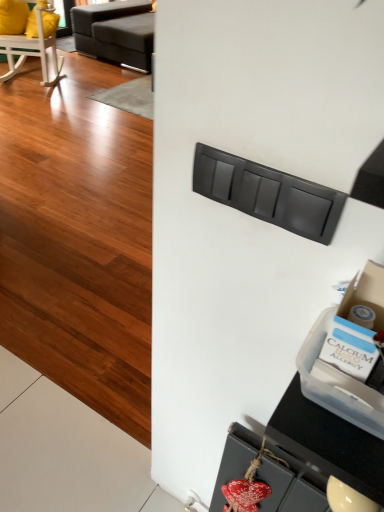
What do you see at coordinates (32, 49) in the screenshot? I see `wooden rocking chair at upper left` at bounding box center [32, 49].

Identify the location of matte black drawer at center, which ranks as the second drawer in bottom-to-top order. click(x=268, y=194).

This screenshot has width=384, height=512. What do you see at coordinates (116, 32) in the screenshot? I see `dark gray fabric studio couch at upper left` at bounding box center [116, 32].

Find the location of a particular element. The height and width of the screenshot is (512, 384). wooden rocking chair at upper left is located at coordinates (32, 49).

Which object is positioned more to the left, matte black drawer at center, which is the 1th drawer from top to bottom, or wooden rocking chair at upper left?

From the viewer's perspective, wooden rocking chair at upper left appears more on the left side.

Between matte black drawer at center, which ranks as the second drawer in bottom-to-top order, and wooden rocking chair at upper left, which one has more height?

wooden rocking chair at upper left.

Does matte black drawer at center, which is the 1th drawer from front to back, turn towards wooden rocking chair at upper left?

No, matte black drawer at center, which is the 1th drawer from front to back, is not aimed at wooden rocking chair at upper left.

The width and height of the screenshot is (384, 512). In order to click on chair on the left of the matte gray drawer at lower center, the 1th drawer when ordered from bottom to top in this screenshot , I will do click(32, 49).

Does matte gray drawer at lower center, the 2th drawer in the front-to-back sequence, lie behind wooden rocking chair at upper left?

No.

Is matte gray drawer at lower center, placed as the second drawer when sorted from top to bottom, bigger than wooden rocking chair at upper left?

Actually, matte gray drawer at lower center, placed as the second drawer when sorted from top to bottom, might be smaller than wooden rocking chair at upper left.

Which is in front, point (293, 506) or point (53, 42)?

The point (293, 506) is closer to the camera.

Is dark gray fabric studio couch at upper left turned away from wooden rocking chair at upper left?

dark gray fabric studio couch at upper left is not turned away from wooden rocking chair at upper left.

Is the position of dark gray fabric studio couch at upper left less distant than that of wooden rocking chair at upper left?

No, dark gray fabric studio couch at upper left is further to the viewer.

You are a GUI agent. You are given a task and a screenshot of the screen. Output one action in this format:
    pyautogui.click(x=<x>, y=<y>)
    Task: Click on the studio couch lying above the wooden rocking chair at upper left (from the image's perspective)
    The width and height of the screenshot is (384, 512).
    Given the screenshot: What is the action you would take?
    pyautogui.click(x=116, y=32)

Considering the relative sizes of dark gray fabric studio couch at upper left and wooden rocking chair at upper left in the image provided, is dark gray fabric studio couch at upper left wider than wooden rocking chair at upper left?

Yes.

Is wooden rocking chair at upper left with matte gray drawer at lower center, placed as the second drawer when sorted from top to bottom?

No, wooden rocking chair at upper left is not beside matte gray drawer at lower center, placed as the second drawer when sorted from top to bottom.

What are the coordinates of `chair behind the matte gray drawer at lower center, placed as the second drawer when sorted from top to bottom` in the screenshot? It's located at (32, 49).

From the image's perspective, relative to matte gray drawer at lower center, the 1th drawer when ordered from bottom to top, is wooden rocking chair at upper left above or below?

From the image's perspective, wooden rocking chair at upper left appears above matte gray drawer at lower center, the 1th drawer when ordered from bottom to top.

Measure the distance from wooden rocking chair at upper left to matte gray drawer at lower center, the 1th drawer when ordered from bottom to top.

wooden rocking chair at upper left is 4.23 meters away from matte gray drawer at lower center, the 1th drawer when ordered from bottom to top.

From the image's perspective, is matte gray drawer at lower center, the 2th drawer in the front-to-back sequence, over dark gray fabric studio couch at upper left?

No, from the image's perspective, matte gray drawer at lower center, the 2th drawer in the front-to-back sequence, is not on top of dark gray fabric studio couch at upper left.

How many degrees apart are the facing directions of matte gray drawer at lower center, the 2th drawer in the front-to-back sequence, and dark gray fabric studio couch at upper left?

0.555 degrees.

Is matte gray drawer at lower center, the 1th drawer when ordered from bottom to top, touching dark gray fabric studio couch at upper left?

matte gray drawer at lower center, the 1th drawer when ordered from bottom to top, is not next to dark gray fabric studio couch at upper left, and they're not touching.

In the scene shown: Between matte gray drawer at lower center, which ranks as the first drawer in back-to-front order, and dark gray fabric studio couch at upper left, which one has less height?

matte gray drawer at lower center, which ranks as the first drawer in back-to-front order.

Which is in front, point (36, 8) or point (208, 183)?

The point (208, 183) is in front.

Is wooden rocking chair at upper left to the left of matte black drawer at center, which is the 1th drawer from top to bottom, from the viewer's perspective?

Correct, you'll find wooden rocking chair at upper left to the left of matte black drawer at center, which is the 1th drawer from top to bottom.

Looking at this image, is dark gray fabric studio couch at upper left facing away from matte gray drawer at lower center, the 1th drawer when ordered from bottom to top?

That's not correct — dark gray fabric studio couch at upper left is not looking away from matte gray drawer at lower center, the 1th drawer when ordered from bottom to top.

Would you consider dark gray fabric studio couch at upper left to be distant from matte gray drawer at lower center, which ranks as the first drawer in back-to-front order?

Yes, dark gray fabric studio couch at upper left and matte gray drawer at lower center, which ranks as the first drawer in back-to-front order, are located far from each other.

From a real-world perspective, who is located lower, dark gray fabric studio couch at upper left or matte gray drawer at lower center, which ranks as the first drawer in back-to-front order?

From a 3D spatial view, dark gray fabric studio couch at upper left is below.

Locate an element on the screen. Image resolution: width=384 pixels, height=512 pixels. chair that appears behind the matte black drawer at center, which ranks as the second drawer in bottom-to-top order is located at coordinates (32, 49).

Where is `chair located above the matte gray drawer at lower center, which ranks as the first drawer in back-to-front order (from the image's perspective)`? This screenshot has height=512, width=384. chair located above the matte gray drawer at lower center, which ranks as the first drawer in back-to-front order (from the image's perspective) is located at coordinates (32, 49).

Considering their positions, is wooden rocking chair at upper left positioned closer to matte gray drawer at lower center, the 1th drawer when ordered from bottom to top, than matte black drawer at center, which ranks as the second drawer in bottom-to-top order?

Among the two, matte black drawer at center, which ranks as the second drawer in bottom-to-top order, is located nearer to matte gray drawer at lower center, the 1th drawer when ordered from bottom to top.

From the image, which object appears to be farther from wooden rocking chair at upper left, dark gray fabric studio couch at upper left or matte gray drawer at lower center, which ranks as the first drawer in back-to-front order?

matte gray drawer at lower center, which ranks as the first drawer in back-to-front order.

Estimate the real-world distances between objects in this image. Which object is further from dark gray fabric studio couch at upper left, matte black drawer at center, the 2th drawer when ordered from back to front, or wooden rocking chair at upper left?

matte black drawer at center, the 2th drawer when ordered from back to front.

When comparing their distances from matte gray drawer at lower center, the 1th drawer when ordered from bottom to top, does matte black drawer at center, which is the 1th drawer from front to back, or wooden rocking chair at upper left seem further?

The object further to matte gray drawer at lower center, the 1th drawer when ordered from bottom to top, is wooden rocking chair at upper left.

Based on the photo, estimate the real-world distances between objects in this image. Which object is closer to dark gray fabric studio couch at upper left, wooden rocking chair at upper left or matte black drawer at center, which ranks as the second drawer in bottom-to-top order?

wooden rocking chair at upper left is closer to dark gray fabric studio couch at upper left.

Based on their spatial positions, is dark gray fabric studio couch at upper left or wooden rocking chair at upper left closer to matte black drawer at center, which ranks as the second drawer in bottom-to-top order?

wooden rocking chair at upper left lies closer to matte black drawer at center, which ranks as the second drawer in bottom-to-top order, than the other object.

Considering their positions, is wooden rocking chair at upper left positioned further to matte black drawer at center, which is the 1th drawer from top to bottom, than matte gray drawer at lower center, the 1th drawer when ordered from bottom to top?

Based on the image, wooden rocking chair at upper left appears to be further to matte black drawer at center, which is the 1th drawer from top to bottom.

Estimate the real-world distances between objects in this image. Which object is closer to matte gray drawer at lower center, the 2th drawer in the front-to-back sequence, dark gray fabric studio couch at upper left or wooden rocking chair at upper left?

Among the two, wooden rocking chair at upper left is located nearer to matte gray drawer at lower center, the 2th drawer in the front-to-back sequence.

Where is `chair positioned between matte black drawer at center, which is the 1th drawer from front to back, and dark gray fabric studio couch at upper left from near to far`? This screenshot has height=512, width=384. chair positioned between matte black drawer at center, which is the 1th drawer from front to back, and dark gray fabric studio couch at upper left from near to far is located at coordinates click(x=32, y=49).

Locate an element on the screen. Image resolution: width=384 pixels, height=512 pixels. chair that lies between dark gray fabric studio couch at upper left and matte gray drawer at lower center, the 1th drawer when ordered from bottom to top, from top to bottom is located at coordinates (32, 49).

I want to click on drawer located between matte black drawer at center, which is the 1th drawer from front to back, and dark gray fabric studio couch at upper left in the depth direction, so click(x=291, y=484).

The width and height of the screenshot is (384, 512). I want to click on drawer positioned between matte black drawer at center, which ranks as the second drawer in bottom-to-top order, and wooden rocking chair at upper left from near to far, so click(291, 484).